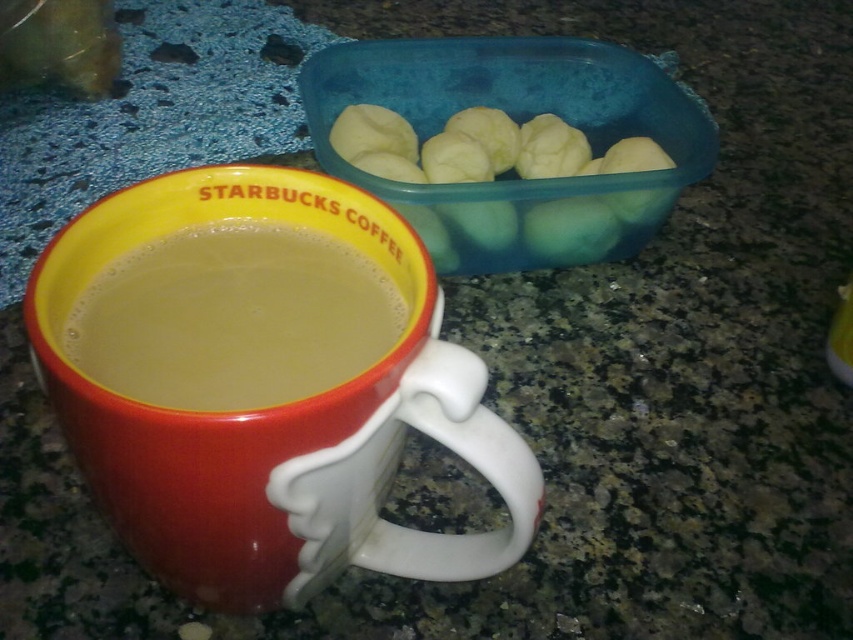
Question: Which point is closer to the camera?

Choices:
 (A) (265, 292)
 (B) (531, 141)

Answer: (A)

Question: Is matte ceramic mug at lower left above smooth white dough balls at upper right?

Choices:
 (A) no
 (B) yes

Answer: (A)

Question: In this image, where is matte ceramic mug at lower left located relative to smooth white dough balls at upper right?

Choices:
 (A) above
 (B) below

Answer: (B)

Question: Which point is farther from the camera taking this photo?

Choices:
 (A) (221, 280)
 (B) (461, 426)

Answer: (A)

Question: Estimate the real-world distances between objects in this image. Which object is closer to the matte ceramic mug at lower left?

Choices:
 (A) smooth white dough balls at upper right
 (B) matte ceramic mug at center

Answer: (B)

Question: Does matte ceramic mug at lower left have a smaller size compared to smooth white dough balls at upper right?

Choices:
 (A) yes
 (B) no

Answer: (A)